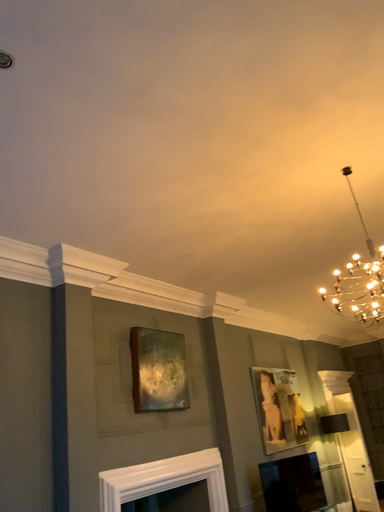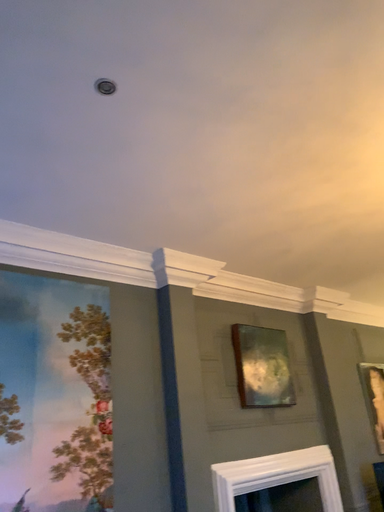
Question: Which way did the camera rotate in the video?

Choices:
 (A) rotated left
 (B) rotated right

Answer: (A)